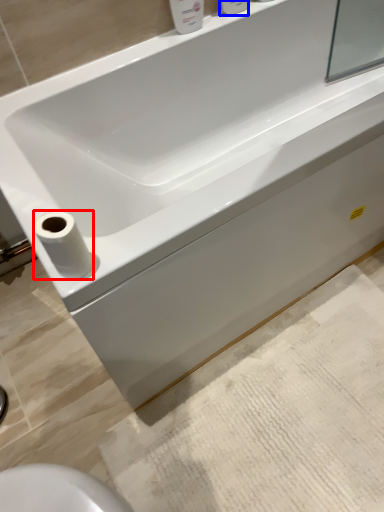
Question: Which object appears farthest to the camera in this image, toilet paper (highlighted by a red box) or toiletry (highlighted by a blue box)?

Choices:
 (A) toilet paper
 (B) toiletry

Answer: (B)